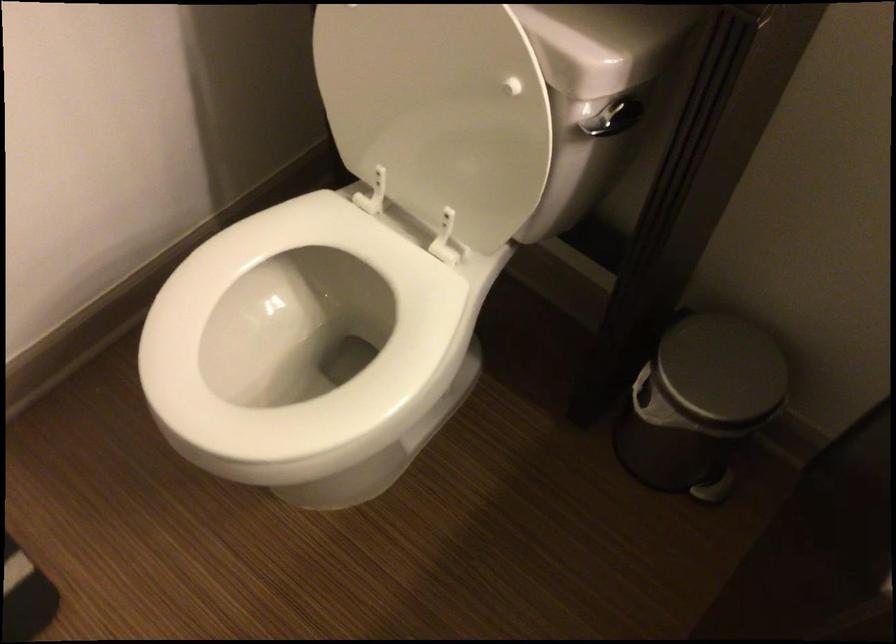
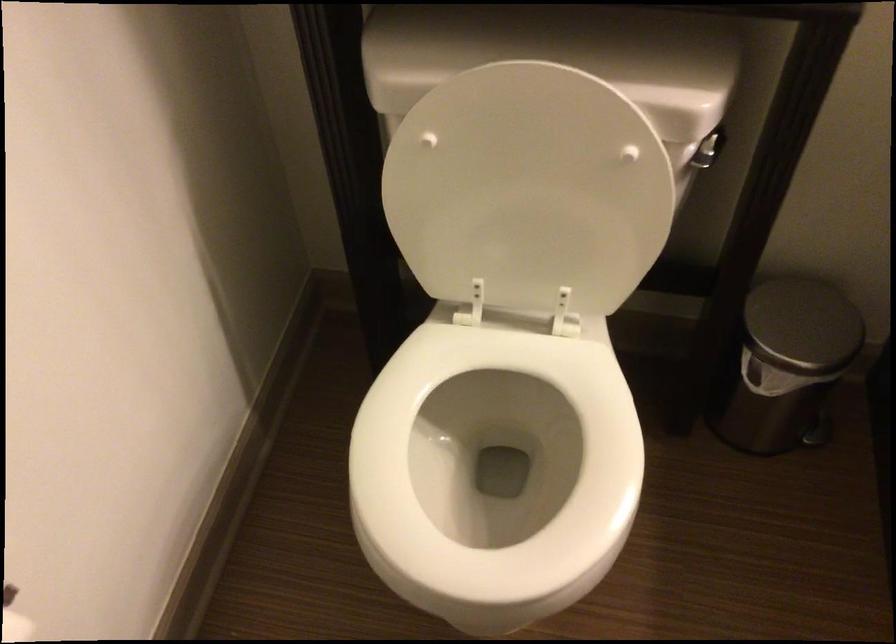
Question: The camera is either moving clockwise (left) or counter-clockwise (right) around the object. The first image is from the beginning of the video and the second image is from the end. Is the camera moving left or right when shooting the video?

Choices:
 (A) Left
 (B) Right

Answer: (A)